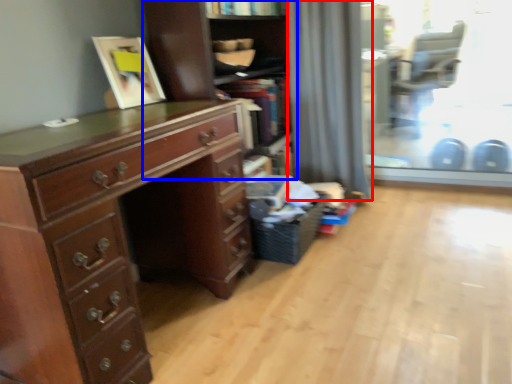
Question: Which of the following is the closest to the observer, curtain (highlighted by a red box) or shelf (highlighted by a blue box)?

Choices:
 (A) curtain
 (B) shelf

Answer: (B)